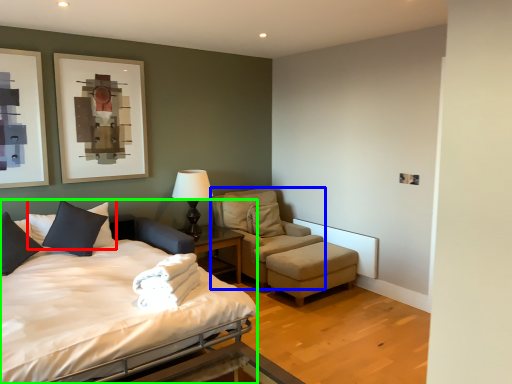
Question: Considering the real-world distances, which object is farthest from pillow (highlighted by a red box)? chair (highlighted by a blue box) or bed (highlighted by a green box)?

Choices:
 (A) chair
 (B) bed

Answer: (A)